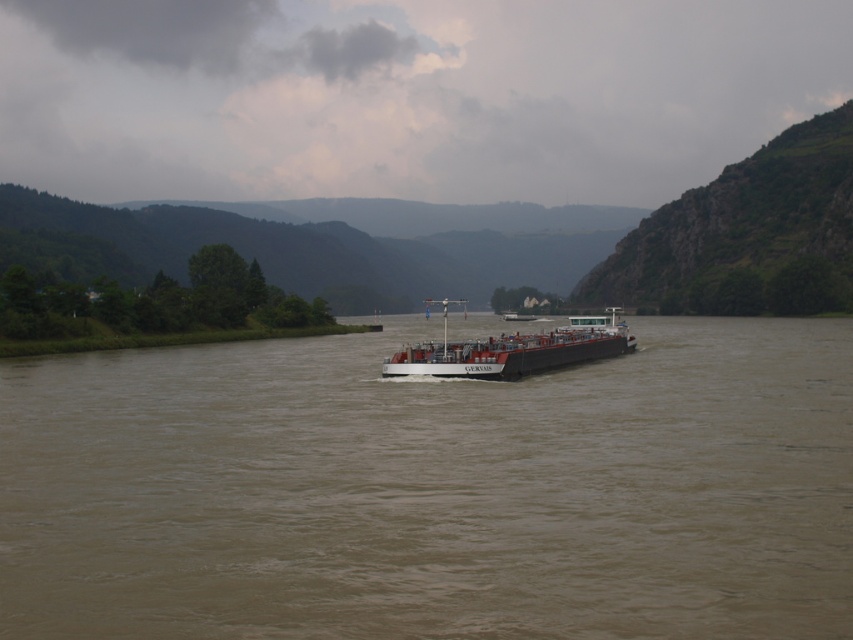
You are a photographer planning to capture the entire white matte barge at center and brown matte river at center in a single frame. Given the scene described, which object will require you to adjust your camera angle more to ensure both fit in the frame?

The brown matte river at center requires more adjustment because its width surpasses that of the white matte barge at center, meaning the river occupies more space in the frame.

You are standing on the left bank of the river and see the brown matte river at center and the white matte barge at center. Which object is closer to your left side?

The brown matte river at center is closer to your left side since it is positioned to the left of the white matte barge at center.

You are standing at the edge of the river and want to take a photo of both the point at coordinates (x=813, y=586) and the point at coordinates (x=440, y=342). Which point will appear larger in your photo?

Point (x=813, y=586) is closer to the camera than point (x=440, y=342), so it will appear larger in the photo.